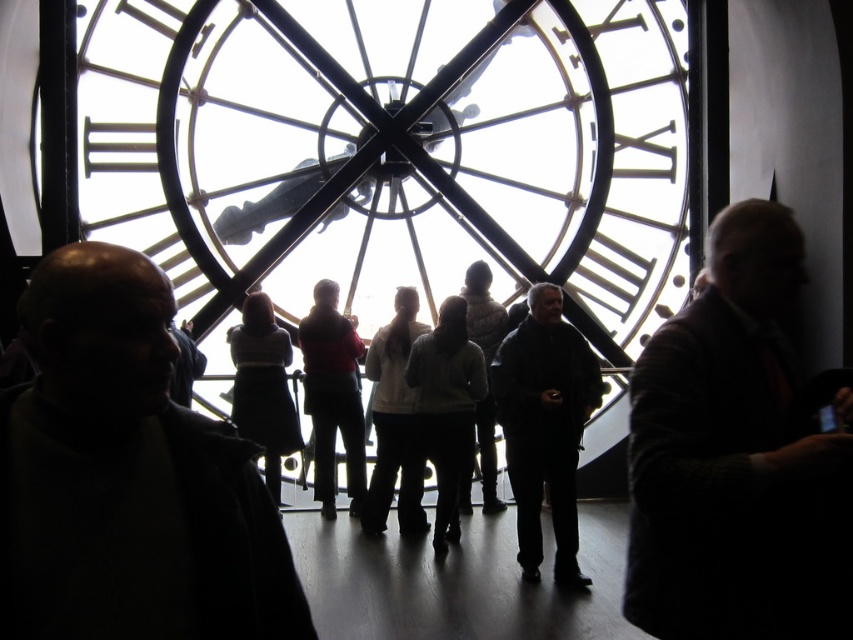
You are standing in the room with the large clock and notice a point marked at coordinates (126, 476). Based on the scene description, where exactly is this point located in relation to the dark matte jacket at left?

The point at (126, 476) is located on the dark matte jacket at left.

You are standing in a dimly lit room with a large clock in the background. You notice a point marked at coordinates (334, 396). What object is located at that point?

The point at coordinates (334, 396) marks the location of the matte red sweater at center.